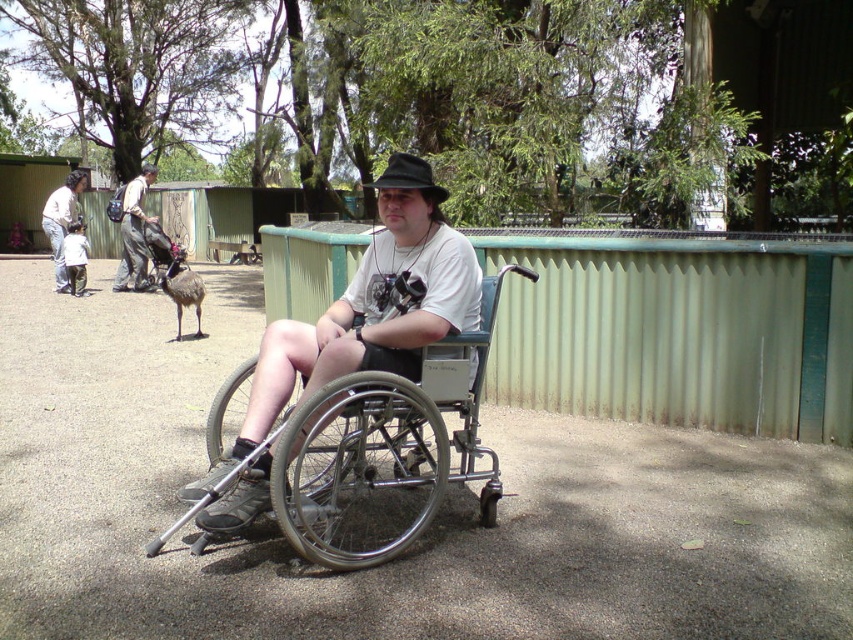
Consider the image. You are a visitor at the zoo with a light brown leather backpack at upper left and a camera. You want to take a photo of an animal located between them. Can you reach the camera without moving the backpack?

The light brown leather backpack at upper left and the camera are 11.75 meters apart from each other. Since the distance is quite large, you would need to move either the backpack or the camera to take the photo, so you cannot reach the camera without moving the backpack.

You are a visitor at the zoo and want to take a photo of the silver metallic wheelchair at center and the black felt hat at center. Which object should you focus on first if you want to capture both in a single frame without moving the camera?

The silver metallic wheelchair at center has a larger size compared to the black felt hat at center, so you should focus on the larger object first to ensure both fit in the frame.

You are the person in the wheelchair with the camera. You want to take a photo of the point at coordinate [138,269]. Can you reach that point with your camera?

The point at coordinate [138,269] is 12.13 meters away from the camera. Since the camera is mounted on your lap, you can likely capture that point in your photo as long as the camera has a sufficient zoom capability to focus on distant objects.